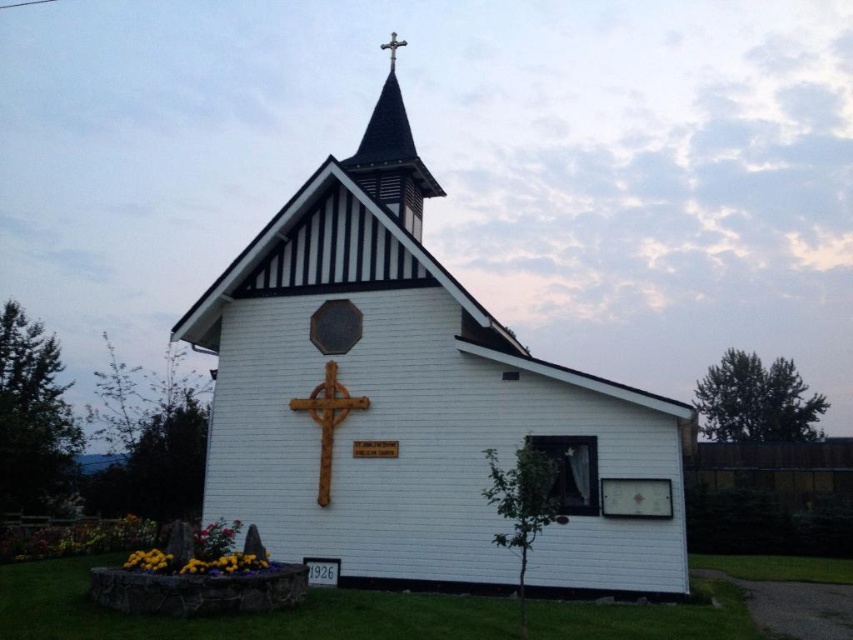
Question: Does white wooden chapel at center have a greater width compared to rusty wood crucifix at center?

Choices:
 (A) yes
 (B) no

Answer: (A)

Question: Which of the following is the closest to the observer?

Choices:
 (A) rusty wood crucifix at center
 (B) white wooden chapel at center

Answer: (B)

Question: Which object appears farthest from the camera in this image?

Choices:
 (A) white wooden chapel at center
 (B) wooden cross at upper center
 (C) black wood spire at upper center

Answer: (B)

Question: Among these points, which one is nearest to the camera?

Choices:
 (A) click(381, 44)
 (B) click(393, 113)

Answer: (B)

Question: Does black wood spire at upper center have a greater width compared to wooden cross at upper center?

Choices:
 (A) yes
 (B) no

Answer: (A)

Question: Can you confirm if white wooden chapel at center is bigger than black wood spire at upper center?

Choices:
 (A) no
 (B) yes

Answer: (A)